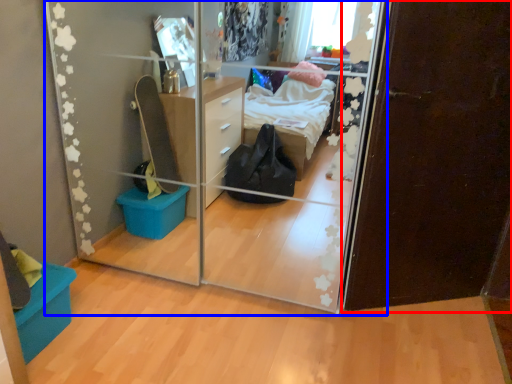
Question: Which object is closer to the camera taking this photo, door (highlighted by a red box) or glass door (highlighted by a blue box)?

Choices:
 (A) door
 (B) glass door

Answer: (B)